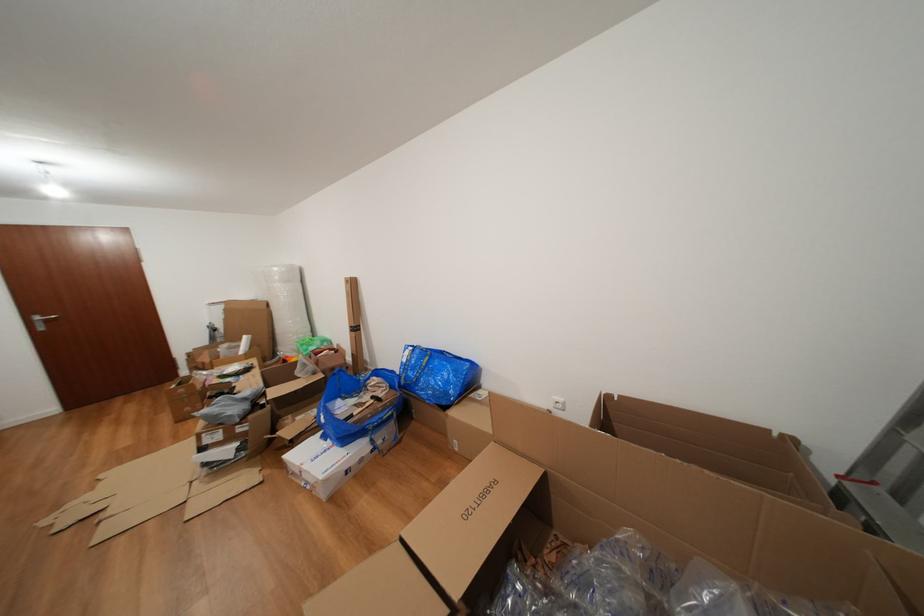
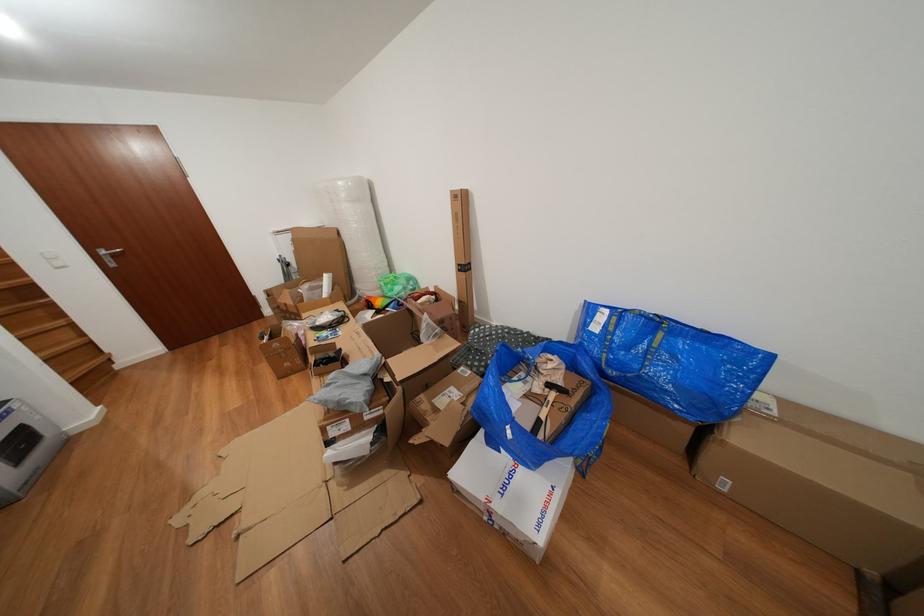
The point at (325, 463) is marked in the first image. Where is the corresponding point in the second image?

(513, 493)